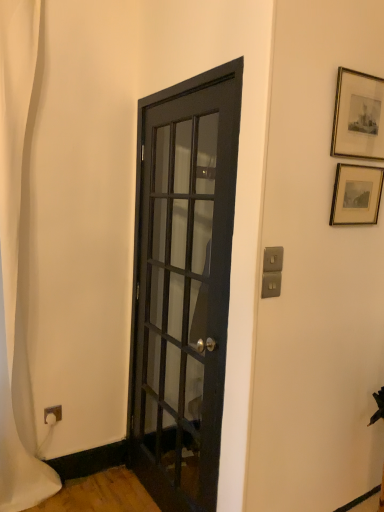
Question: Could you tell me if gold-framed picture at upper right, which appears as the second picture frame when viewed from the top, is facing white fabric shower curtain at left?

Choices:
 (A) yes
 (B) no

Answer: (B)

Question: From a real-world perspective, is gold-framed picture at upper right, which appears as the second picture frame when viewed from the top, located beneath white fabric shower curtain at left?

Choices:
 (A) yes
 (B) no

Answer: (B)

Question: Is white fabric shower curtain at left located within gold-framed picture at upper right, which is the first picture frame from bottom to top?

Choices:
 (A) no
 (B) yes

Answer: (A)

Question: From the image's perspective, does gold-framed picture at upper right, which is the first picture frame from bottom to top, appear lower than white fabric shower curtain at left?

Choices:
 (A) yes
 (B) no

Answer: (B)

Question: Is gold-framed picture at upper right, which is the first picture frame from bottom to top, smaller than white fabric shower curtain at left?

Choices:
 (A) no
 (B) yes

Answer: (B)

Question: Are gold-framed picture at upper right, which appears as the second picture frame when viewed from the top, and white fabric shower curtain at left far apart?

Choices:
 (A) no
 (B) yes

Answer: (B)

Question: Considering the relative positions of white fabric shower curtain at left and gold-framed picture at upper right, which is the first picture frame from bottom to top, in the image provided, is white fabric shower curtain at left to the right of gold-framed picture at upper right, which is the first picture frame from bottom to top, from the viewer's perspective?

Choices:
 (A) no
 (B) yes

Answer: (A)

Question: Is white fabric shower curtain at left located outside gold-framed picture at upper right, which appears as the second picture frame when viewed from the top?

Choices:
 (A) no
 (B) yes

Answer: (B)

Question: Is the position of white fabric shower curtain at left more distant than that of gold-framed picture at upper right, which is the first picture frame from bottom to top?

Choices:
 (A) yes
 (B) no

Answer: (A)

Question: From a real-world perspective, does white fabric shower curtain at left stand above gold-framed picture at upper right, which is the first picture frame from bottom to top?

Choices:
 (A) no
 (B) yes

Answer: (A)

Question: Does white fabric shower curtain at left appear on the left side of gold-framed picture at upper right, which appears as the second picture frame when viewed from the top?

Choices:
 (A) no
 (B) yes

Answer: (B)

Question: Is white fabric shower curtain at left positioned before gold-framed picture at upper right, which appears as the second picture frame when viewed from the top?

Choices:
 (A) yes
 (B) no

Answer: (B)

Question: Does gold-framed print at upper right, which is the first picture frame from top to bottom, appear on the left side of white fabric shower curtain at left?

Choices:
 (A) yes
 (B) no

Answer: (B)